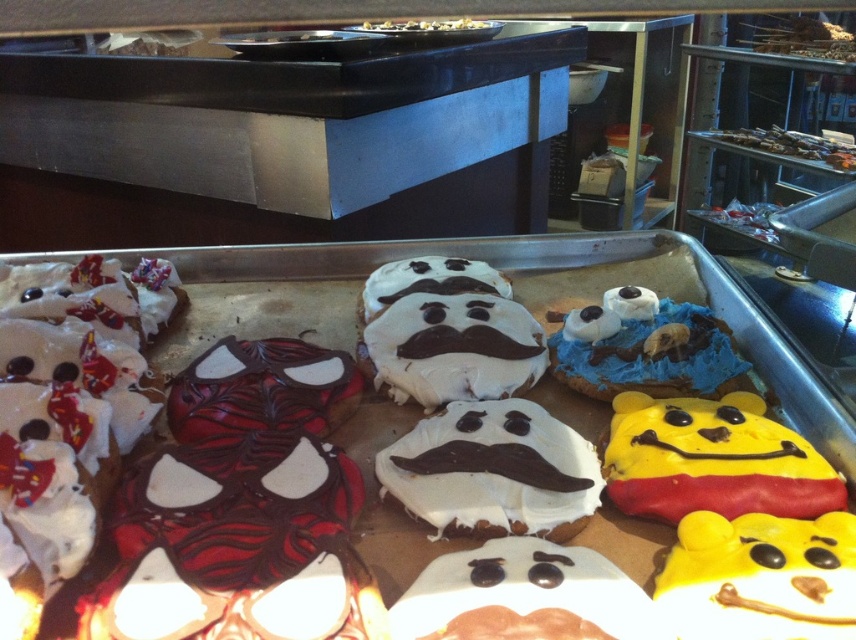
You are a baker arranging cookies on a tray. You need to place a new cookie exactly at the center of the tray. The tray has a coordinate system where the bottom left corner is the origin. Is the white chocolate cookie with mustache at center currently blocking that spot?

The white chocolate cookie with mustache at center is located at point (492, 472), which is not the exact center of the tray. The center would be at coordinates (428, 320), so the cookie is slightly to the right and above the center. Therefore, it is not blocking the exact center spot.